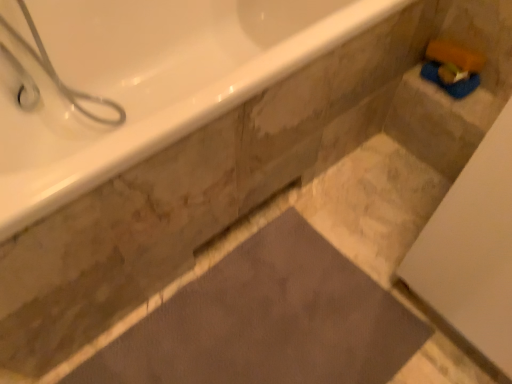
Question: Does white glossy bathtub at upper left have a lesser width compared to white glossy shower at upper left?

Choices:
 (A) no
 (B) yes

Answer: (A)

Question: Is white glossy bathtub at upper left aimed at white glossy shower at upper left?

Choices:
 (A) yes
 (B) no

Answer: (A)

Question: Can you confirm if white glossy bathtub at upper left is positioned to the right of white glossy shower at upper left?

Choices:
 (A) no
 (B) yes

Answer: (B)

Question: Can you confirm if white glossy bathtub at upper left is wider than white glossy shower at upper left?

Choices:
 (A) no
 (B) yes

Answer: (B)

Question: Is white glossy bathtub at upper left completely or partially outside of white glossy shower at upper left?

Choices:
 (A) yes
 (B) no

Answer: (A)

Question: From a real-world perspective, is dark gray matte bath mat at center positioned above or below white glossy bathtub at upper left?

Choices:
 (A) below
 (B) above

Answer: (A)

Question: Relative to white glossy bathtub at upper left, is dark gray matte bath mat at center in front or behind?

Choices:
 (A) behind
 (B) front

Answer: (A)

Question: Is dark gray matte bath mat at center bigger or smaller than white glossy bathtub at upper left?

Choices:
 (A) small
 (B) big

Answer: (A)

Question: In terms of height, does dark gray matte bath mat at center look taller or shorter compared to white glossy bathtub at upper left?

Choices:
 (A) short
 (B) tall

Answer: (A)

Question: Would you say white glossy shower at upper left is to the left or to the right of white glossy bathtub at upper left in the picture?

Choices:
 (A) right
 (B) left

Answer: (B)

Question: Considering their positions, is white glossy shower at upper left located in front of or behind white glossy bathtub at upper left?

Choices:
 (A) front
 (B) behind

Answer: (B)

Question: Looking at their shapes, would you say white glossy shower at upper left is wider or thinner than white glossy bathtub at upper left?

Choices:
 (A) wide
 (B) thin

Answer: (B)

Question: From a real-world perspective, is white glossy shower at upper left above or below white glossy bathtub at upper left?

Choices:
 (A) above
 (B) below

Answer: (A)

Question: In terms of height, does white glossy bathtub at upper left look taller or shorter compared to dark gray matte bath mat at center?

Choices:
 (A) short
 (B) tall

Answer: (B)

Question: Considering their positions, is white glossy bathtub at upper left located in front of or behind dark gray matte bath mat at center?

Choices:
 (A) behind
 (B) front

Answer: (B)